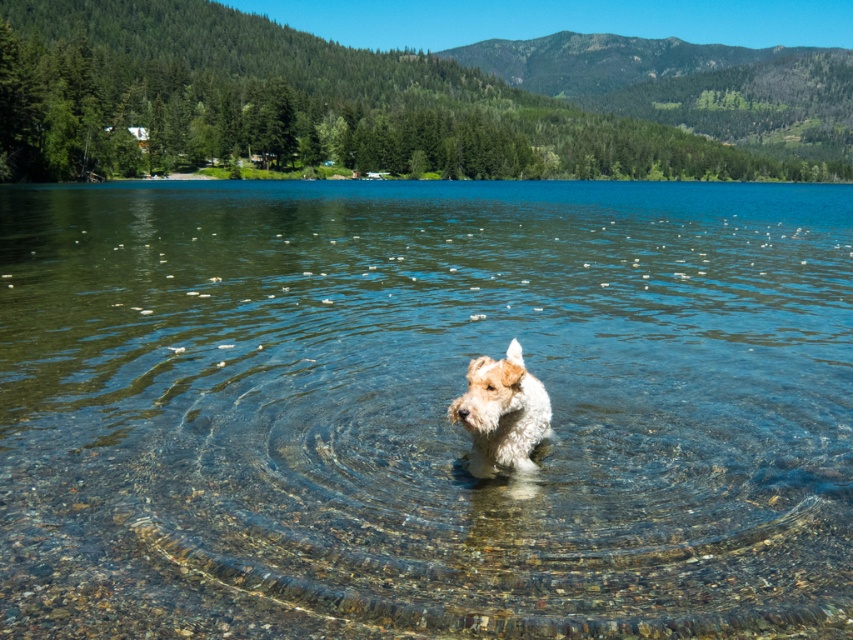
Who is shorter, clear glass water at center or white fur dog at center?

white fur dog at center is shorter.

Does clear glass water at center have a greater width compared to white fur dog at center?

Correct, the width of clear glass water at center exceeds that of white fur dog at center.

Where is `clear glass water at center`? The height and width of the screenshot is (640, 853). clear glass water at center is located at coordinates (422, 408).

At what (x,y) coordinates should I click in order to perform the action: click on clear glass water at center. Please return your answer as a coordinate pair (x, y). Looking at the image, I should click on (422, 408).